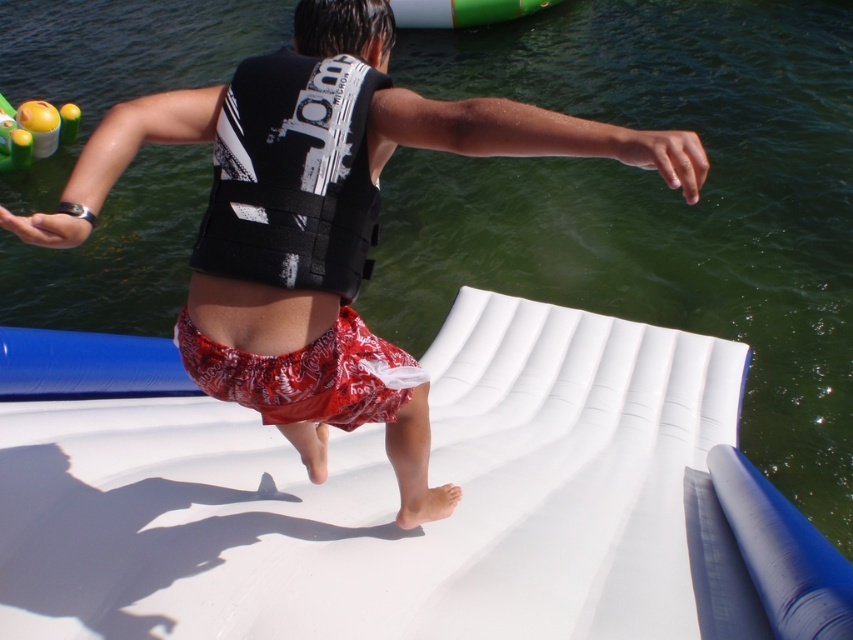
You are a lifeguard observing someone on a water slide. You notice the black matte life jacket at center and the red printed shorts at center. Which item is closer to you?

The black matte life jacket at center is closer to you because it is in front of the red printed shorts at center.

You are a lifeguard on duty and see the white rubber boat at center and the red printed shorts at center in the water. Which object is larger in size?

The white rubber boat at center is bigger than the red printed shorts at center.

You are standing at the starting point of the water slide and see two points marked on the slide. The first point is labeled as point (x=355, y=204) and the second point is labeled as point (x=352, y=374). Which point is closer to you as you begin your slide?

Point (x=355, y=204) is in front of point (x=352, y=374), so the first point is closer to you at the start of the slide.